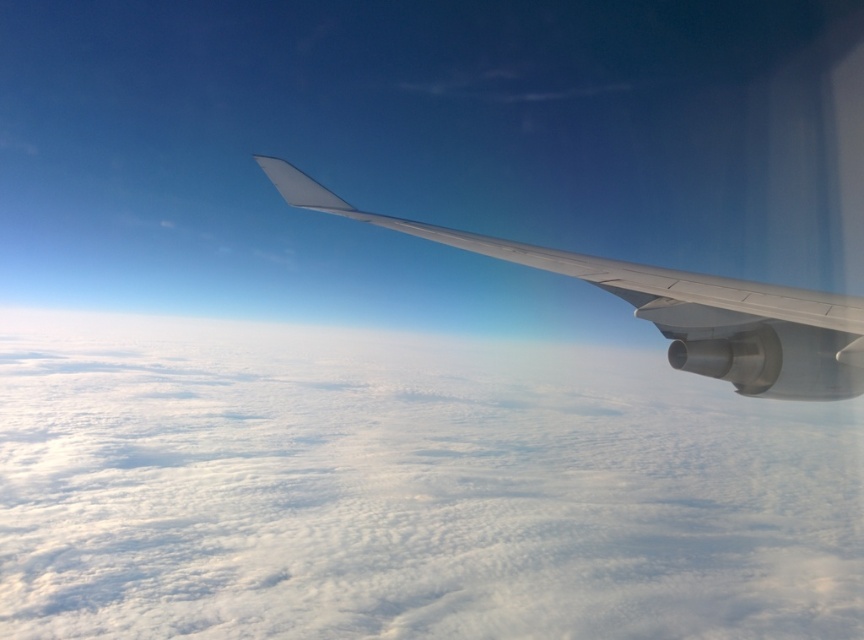
Does white fluffy cloud at upper center appear on the left side of white matte wing at upper right?

Indeed, white fluffy cloud at upper center is positioned on the left side of white matte wing at upper right.

Does white fluffy cloud at upper center lie in front of white matte wing at upper right?

No, it is not.

At what (x,y) coordinates should I click in order to perform the action: click on white fluffy cloud at upper center. Please return your answer as a coordinate pair (x, y). This screenshot has width=864, height=640. Looking at the image, I should click on (407, 488).

Find the location of a particular element. white fluffy cloud at upper center is located at coordinates (407, 488).